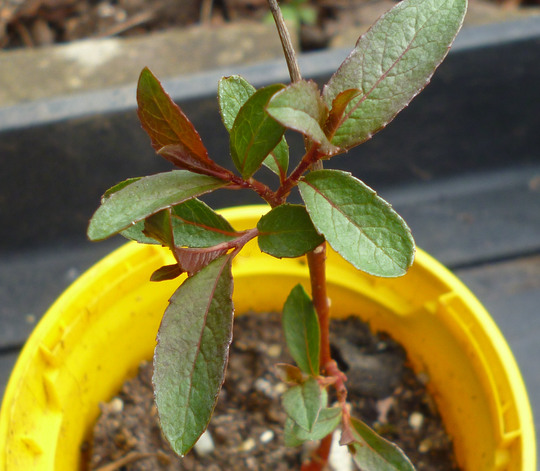
Where is `pot`? This screenshot has height=471, width=540. pot is located at coordinates (413, 345).